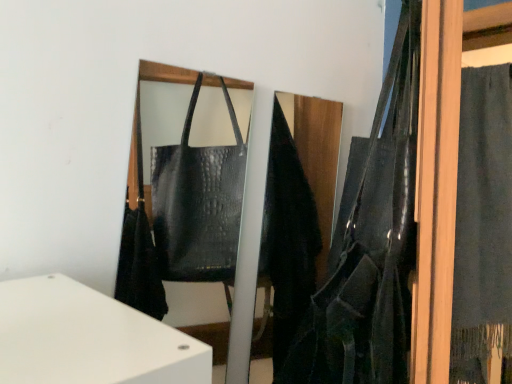
Question: Is dark blue fabric at right aimed at leather textured shoulder bag at right?

Choices:
 (A) yes
 (B) no

Answer: (A)

Question: Is dark blue fabric at right further to camera compared to leather textured shoulder bag at right?

Choices:
 (A) no
 (B) yes

Answer: (B)

Question: Is dark blue fabric at right looking in the opposite direction of leather textured shoulder bag at right?

Choices:
 (A) no
 (B) yes

Answer: (A)

Question: From the image's perspective, is dark blue fabric at right under leather textured shoulder bag at right?

Choices:
 (A) no
 (B) yes

Answer: (B)

Question: Can you confirm if dark blue fabric at right is positioned to the left of leather textured shoulder bag at right?

Choices:
 (A) yes
 (B) no

Answer: (B)

Question: From a real-world perspective, is dark blue fabric at right located beneath leather textured shoulder bag at right?

Choices:
 (A) yes
 (B) no

Answer: (A)

Question: Considering the relative sizes of leather textured shoulder bag at right and dark blue fabric at right in the image provided, is leather textured shoulder bag at right thinner than dark blue fabric at right?

Choices:
 (A) yes
 (B) no

Answer: (A)

Question: Considering the relative sizes of leather textured shoulder bag at right and dark blue fabric at right in the image provided, is leather textured shoulder bag at right wider than dark blue fabric at right?

Choices:
 (A) yes
 (B) no

Answer: (B)

Question: Is leather textured shoulder bag at right outside dark blue fabric at right?

Choices:
 (A) no
 (B) yes

Answer: (B)

Question: From the image's perspective, is leather textured shoulder bag at right located beneath dark blue fabric at right?

Choices:
 (A) no
 (B) yes

Answer: (A)

Question: Is dark blue fabric at right a part of leather textured shoulder bag at right?

Choices:
 (A) no
 (B) yes

Answer: (A)

Question: Considering the relative sizes of leather textured shoulder bag at right and dark blue fabric at right in the image provided, is leather textured shoulder bag at right bigger than dark blue fabric at right?

Choices:
 (A) yes
 (B) no

Answer: (A)

Question: Is dark blue fabric at right spatially inside leather textured shoulder bag at right, or outside of it?

Choices:
 (A) inside
 (B) outside

Answer: (B)